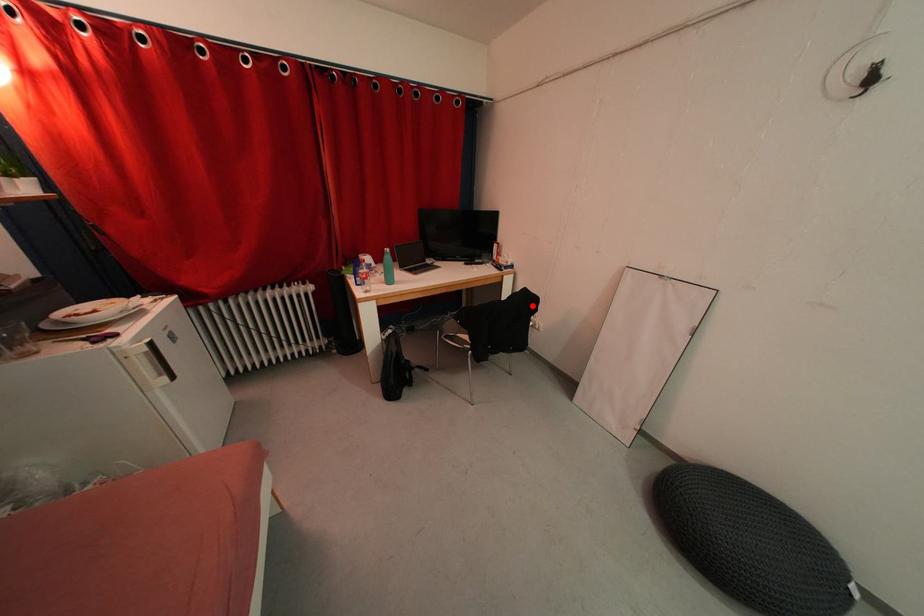
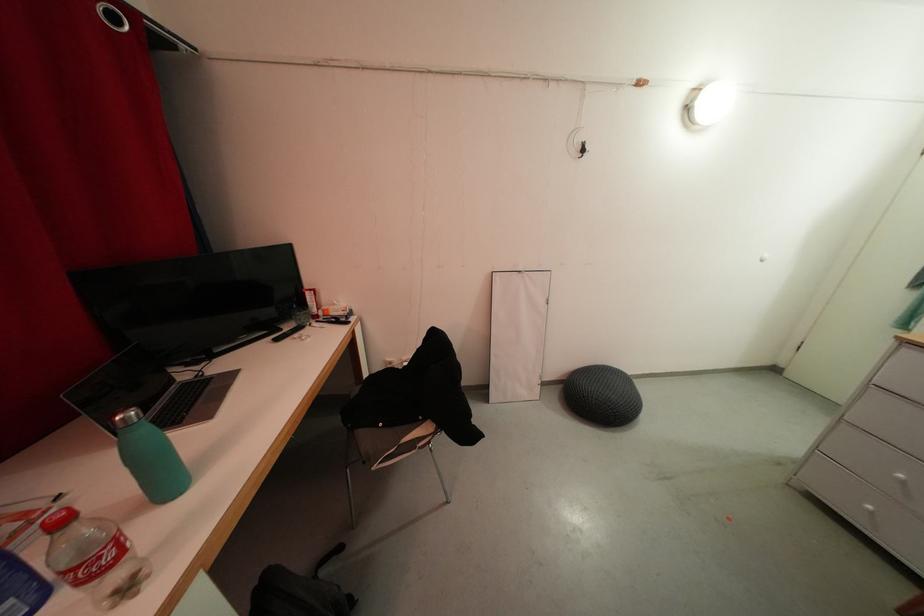
Question: I am providing you with two images of the same scene from different viewpoints. Image1 has a red point marked. In image2, the corresponding 3D location appears at what relative position? Reply with the corresponding letter.

Choices:
 (A) Closer
 (B) Farther

Answer: (A)